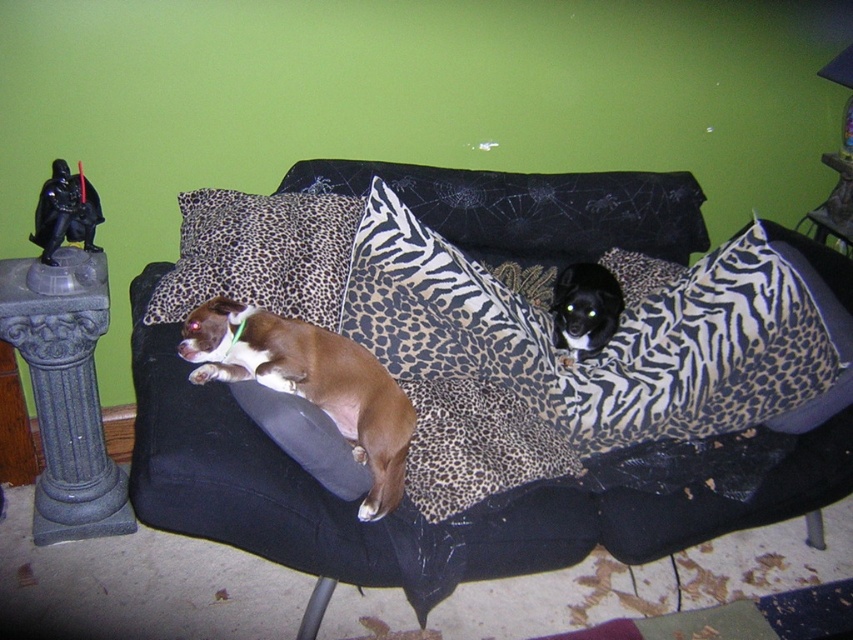
You are arranging a photo shoot in this living room and need to place a large camera on the leopard print fabric couch at center and the leopard print fabric pillow at center. Which object should the camera be placed on if you want it closer to the right side of the room?

The leopard print fabric couch at center is positioned on the right side of leopard print fabric pillow at center, so placing the camera on the leopard print fabric couch at center would position it closer to the right side of the room.

You are a photographer setting up a shoot in this living room. You want to ensure that the leopard print fabric pillow at center and the black fur dog at center are both visible in the frame. Based on their positions, which object is closer to the camera?

The leopard print fabric pillow at center is in front of the black fur dog at center, so the leopard print fabric pillow at center is closer to the camera.

You are a drone operator trying to map the coordinates of objects in the room. The leopard print fabric couch at center is at point A. Where would you place point B to mark the location of the decorative pedestal with Darth Vader?

The decorative pedestal with Darth Vader is to the left of the leopard print fabric couch at center, so point B should be placed to the left of point A.